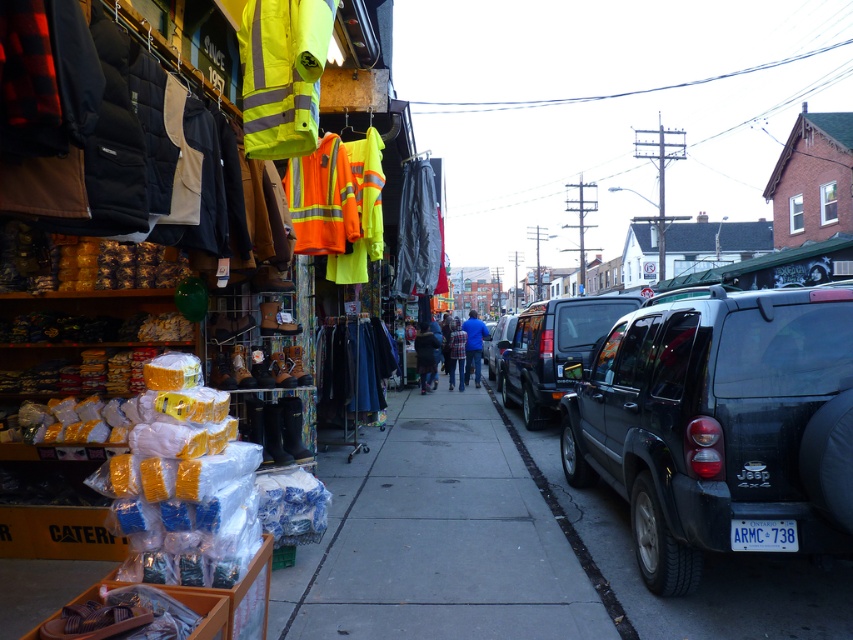
You are a delivery person standing at point (422, 356) and need to deliver a package to point (767, 525). Given that the sidewalk is narrow, can you navigate from your current position to the delivery point without crossing the street?

Yes, you can navigate from point (422, 356) to point (767, 525) without crossing the street because point (767, 525) is in front of point (422, 356), meaning it is along the sidewalk in the forward direction.

You are a delivery person trying to place a blue fabric jacket at center into a matte black suv at right. Will the jacket fit inside the SUV?

The matte black suv at right is wider than the blue fabric jacket at center, so the jacket will fit inside the SUV.